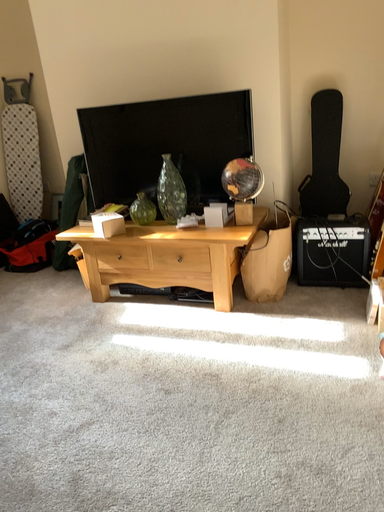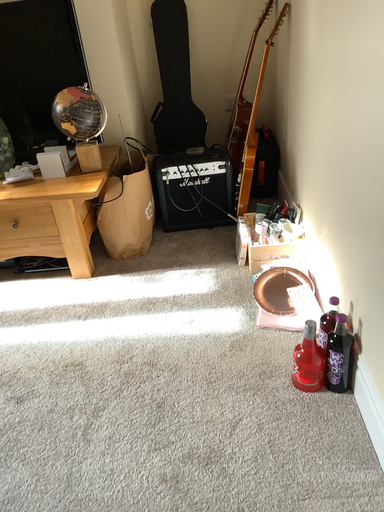
Question: How did the camera likely rotate when shooting the video?

Choices:
 (A) rotated upward
 (B) rotated downward

Answer: (B)